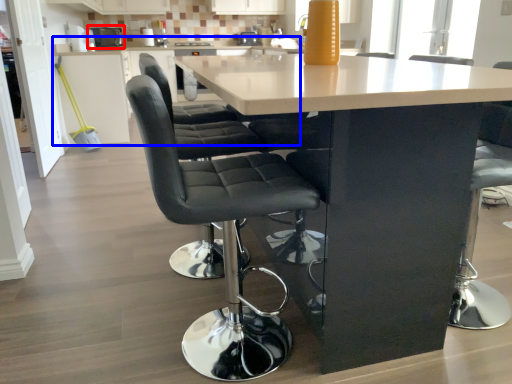
Question: Which object is further to the camera taking this photo, appliance (highlighted by a red box) or counter (highlighted by a blue box)?

Choices:
 (A) appliance
 (B) counter

Answer: (A)